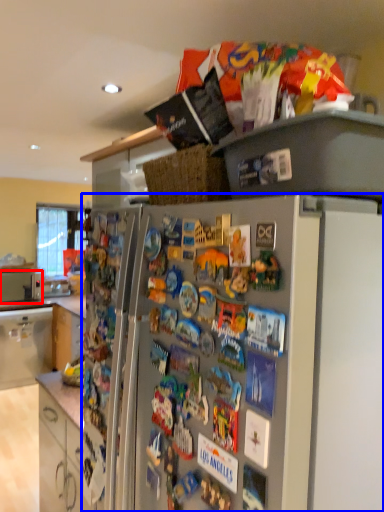
Question: Which object appears farthest to the camera in this image, appliance (highlighted by a red box) or refrigerator (highlighted by a blue box)?

Choices:
 (A) appliance
 (B) refrigerator

Answer: (A)